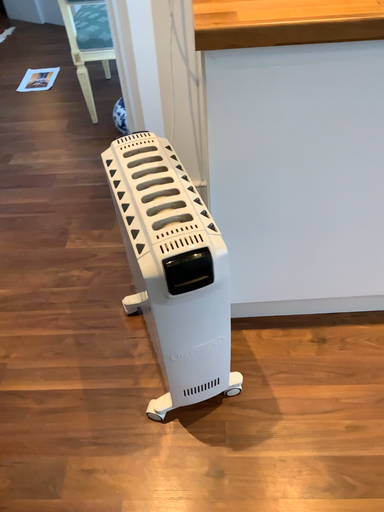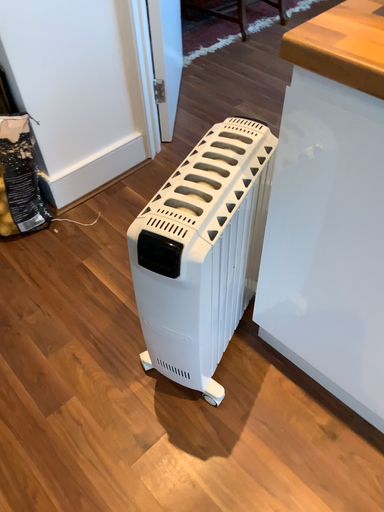
Question: Which way did the camera rotate in the video?

Choices:
 (A) rotated right
 (B) rotated left

Answer: (B)